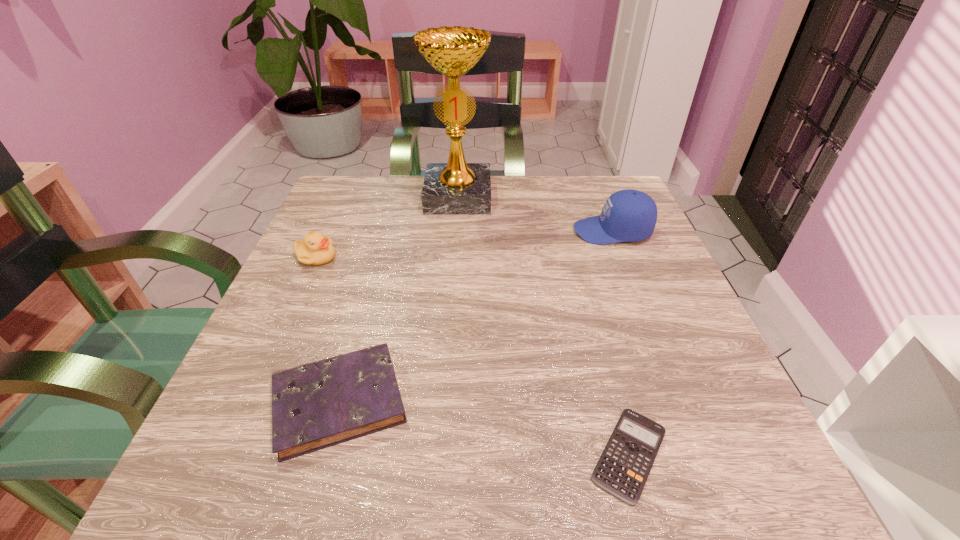
Where is `calculator at the right edge`? calculator at the right edge is located at coordinates (624, 466).

Find the location of a particular element. Image resolution: width=960 pixels, height=540 pixels. object present at the near left corner is located at coordinates 317,405.

The width and height of the screenshot is (960, 540). I want to click on object at the far right corner, so click(628, 215).

This screenshot has width=960, height=540. Identify the location of object located at the near right corner. (624, 466).

The width and height of the screenshot is (960, 540). In the image, there is a desktop. In order to click on blank space at the far edge in this screenshot , I will do `click(412, 195)`.

The width and height of the screenshot is (960, 540). I want to click on vacant space at the near edge of the desktop, so click(x=528, y=495).

Locate an element on the screen. free space at the left edge of the desktop is located at coordinates (239, 413).

The height and width of the screenshot is (540, 960). Identify the location of vacant space at the right edge of the desktop. (704, 390).

At what (x,y) coordinates should I click in order to perform the action: click on free space at the far left corner of the desktop. Please return your answer as a coordinate pair (x, y). The image size is (960, 540). Looking at the image, I should click on (368, 224).

You are a GUI agent. You are given a task and a screenshot of the screen. Output one action in this format:
    pyautogui.click(x=<x>, y=<y>)
    Task: Click on the vacant space at the near left corner of the desktop
    Image resolution: width=960 pixels, height=540 pixels.
    Given the screenshot: What is the action you would take?
    pyautogui.click(x=219, y=462)